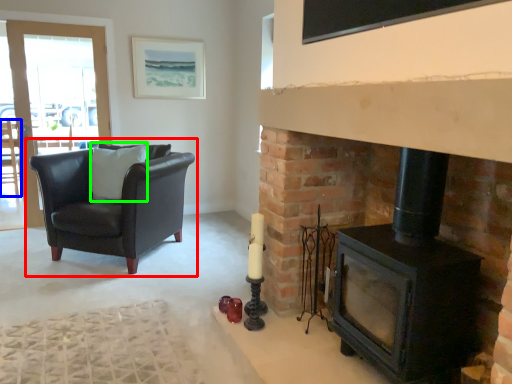
Question: Which object is positioned farthest from chair (highlighted by a red box)? Select from chair (highlighted by a blue box) and pillow (highlighted by a green box).

Choices:
 (A) chair
 (B) pillow

Answer: (A)